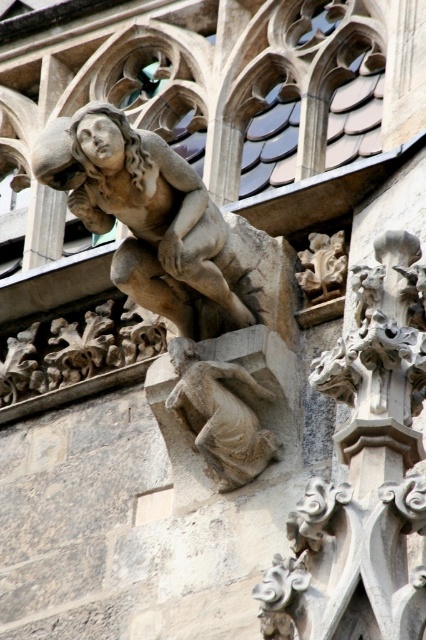
Is stone gargoyle at lower center to the left of white stone gargoyle at upper right from the viewer's perspective?

Correct, you'll find stone gargoyle at lower center to the left of white stone gargoyle at upper right.

The height and width of the screenshot is (640, 426). In order to click on stone gargoyle at lower center in this screenshot , I will do `click(219, 416)`.

This screenshot has width=426, height=640. In order to click on stone gargoyle at lower center in this screenshot , I will do `click(219, 416)`.